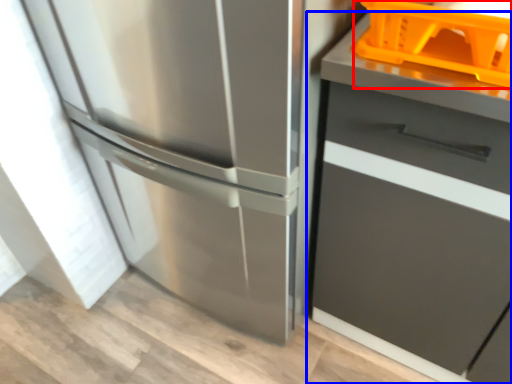
Question: Among these objects, which one is farthest to the camera, basket (highlighted by a red box) or cabinetry (highlighted by a blue box)?

Choices:
 (A) basket
 (B) cabinetry

Answer: (A)